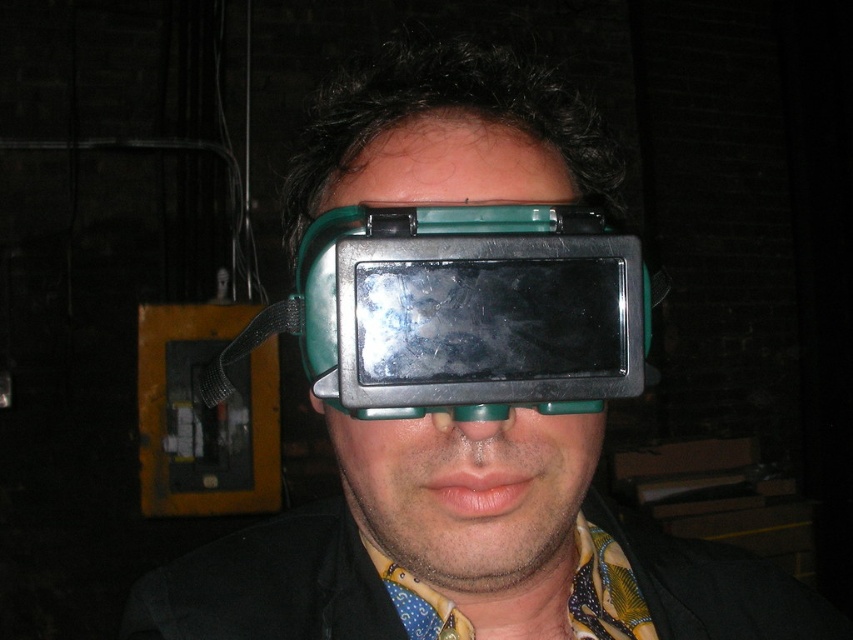
Question: Is green matte/glassy goggles at center bigger than green plastic goggles at center?

Choices:
 (A) no
 (B) yes

Answer: (A)

Question: Among these objects, which one is nearest to the camera?

Choices:
 (A) green matte/glassy goggles at center
 (B) green plastic goggles at center

Answer: (A)

Question: From the image, what is the correct spatial relationship of green matte/glassy goggles at center in relation to green plastic goggles at center?

Choices:
 (A) below
 (B) above

Answer: (B)

Question: In this image, where is green matte/glassy goggles at center located relative to green plastic goggles at center?

Choices:
 (A) above
 (B) below

Answer: (A)